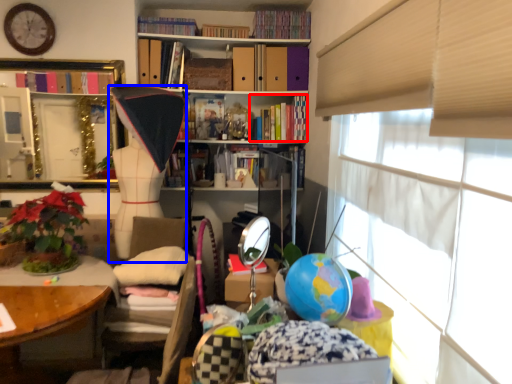
Question: Which object is closer to the camera taking this photo, book (highlighted by a red box) or doll (highlighted by a blue box)?

Choices:
 (A) book
 (B) doll

Answer: (B)